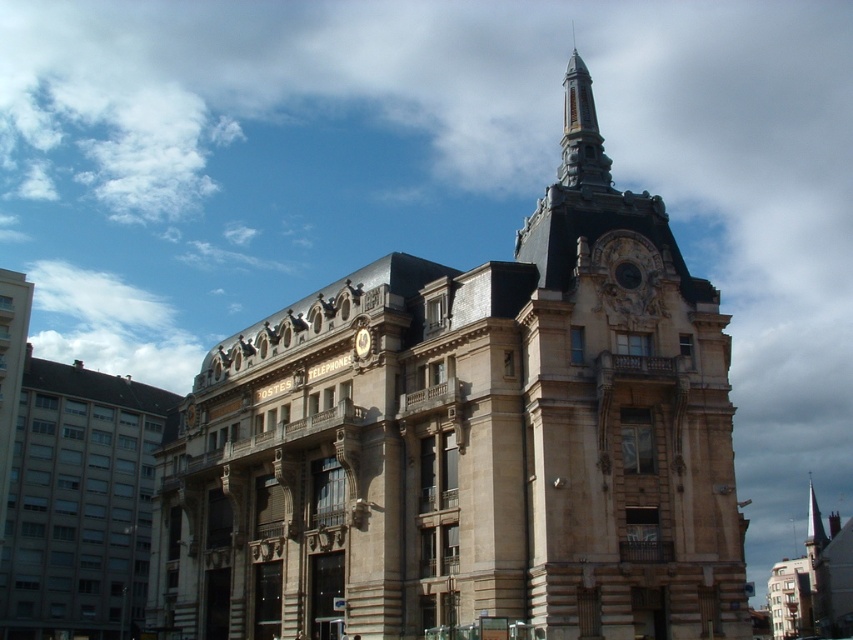
Question: Among these objects, which one is nearest to the camera?

Choices:
 (A) stone steeple at center
 (B) polished stone spire at upper center

Answer: (A)

Question: Can you confirm if stone steeple at center is positioned to the right of polished stone spire at upper center?

Choices:
 (A) yes
 (B) no

Answer: (B)

Question: From the image, what is the correct spatial relationship of stone steeple at center in relation to polished stone spire at upper center?

Choices:
 (A) left
 (B) right

Answer: (A)

Question: Does stone steeple at center appear on the left side of polished stone spire at upper center?

Choices:
 (A) yes
 (B) no

Answer: (A)